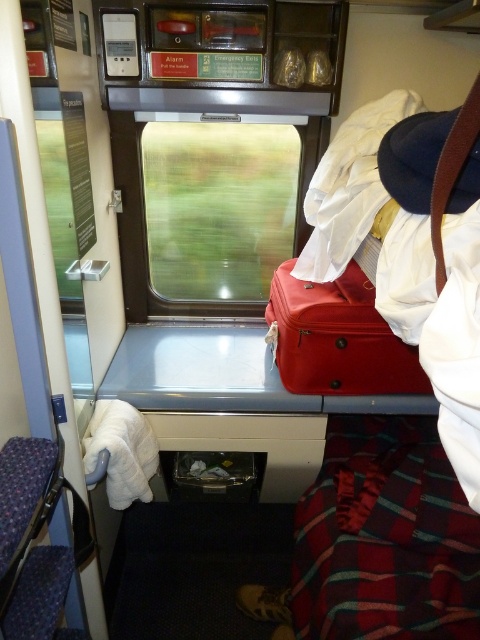
Question: Is transparent glass window at center closer to the viewer compared to matte red suitcase at center?

Choices:
 (A) yes
 (B) no

Answer: (B)

Question: Is transparent glass window at center wider than matte red suitcase at center?

Choices:
 (A) no
 (B) yes

Answer: (B)

Question: Is transparent glass window at center to the left of matte red suitcase at center from the viewer's perspective?

Choices:
 (A) no
 (B) yes

Answer: (B)

Question: Which object appears farthest from the camera in this image?

Choices:
 (A) transparent glass window at center
 (B) matte red suitcase at center

Answer: (A)

Question: Which object appears closest to the camera in this image?

Choices:
 (A) transparent glass window at center
 (B) matte red suitcase at center

Answer: (B)